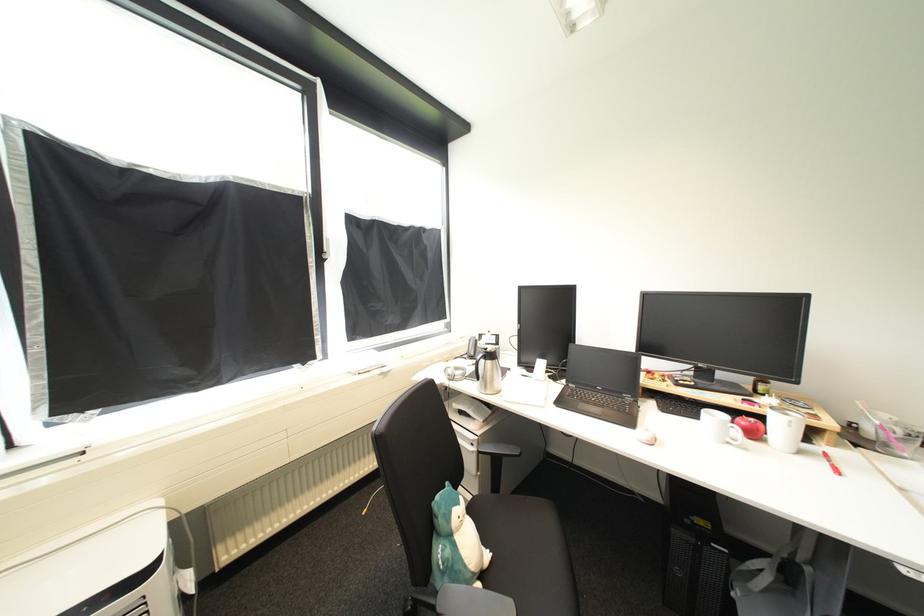
At what (x,y) coordinates should I click in order to perform the action: click on silver thermos. Please return your answer as a coordinate pair (x, y). Looking at the image, I should click on (488, 371).